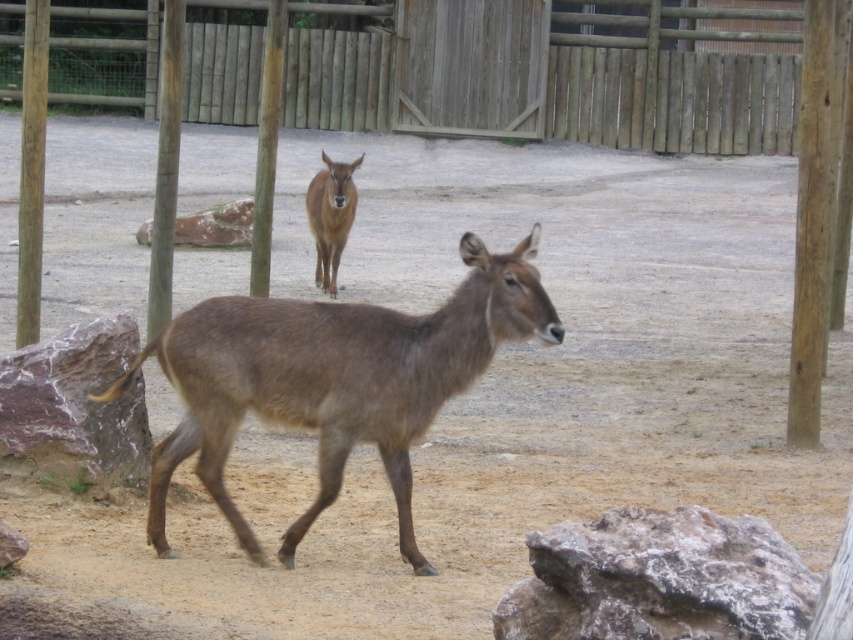
Question: Among these points, which one is farthest from the camera?

Choices:
 (A) (543, 298)
 (B) (318, 278)
 (C) (219, 64)

Answer: (C)

Question: From the image, what is the correct spatial relationship of brown fur deer at center in relation to wooden gate at upper center?

Choices:
 (A) above
 (B) below

Answer: (B)

Question: Can you confirm if brown fur deer at center is positioned to the left of brown glossy antelope at center?

Choices:
 (A) no
 (B) yes

Answer: (A)

Question: Which of these objects is positioned farthest from the brown fur deer at center?

Choices:
 (A) brown glossy antelope at center
 (B) wooden gate at upper center

Answer: (B)

Question: Which point is farther from the camera taking this photo?

Choices:
 (A) (766, 129)
 (B) (340, 232)
 (C) (236, 314)

Answer: (A)

Question: Does brown fur deer at center have a lesser width compared to wooden gate at upper center?

Choices:
 (A) yes
 (B) no

Answer: (A)